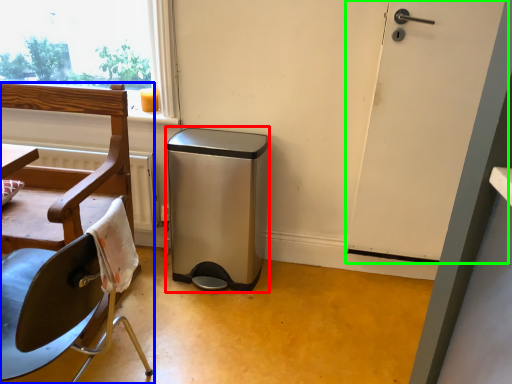
Question: Estimate the real-world distances between objects in this image. Which object is farther from dish washer (highlighted by a red box), chair (highlighted by a blue box) or door (highlighted by a green box)?

Choices:
 (A) chair
 (B) door

Answer: (B)